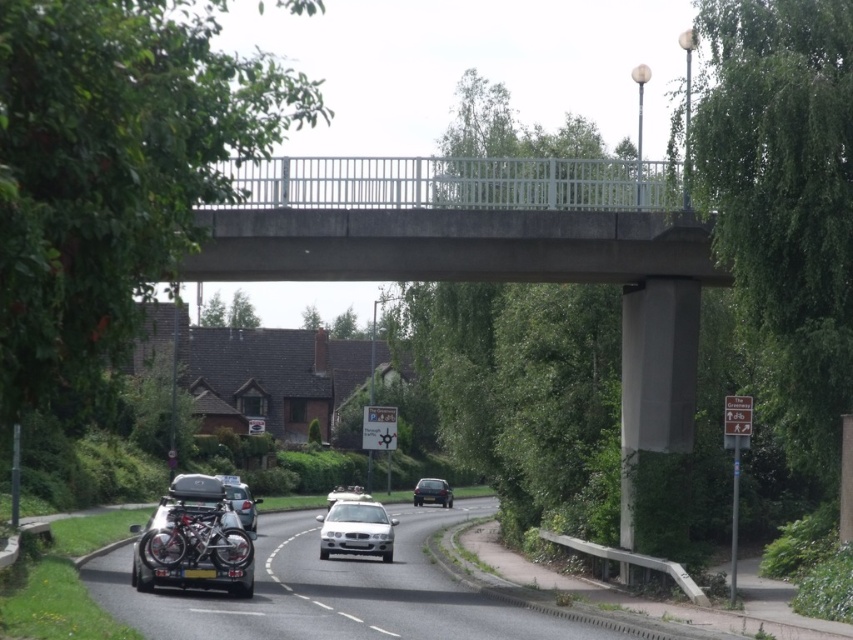
Does metallic silver motorcycle at lower left have a larger size compared to satin silver sedan at center?

Incorrect, metallic silver motorcycle at lower left is not larger than satin silver sedan at center.

Consider the image. Who is more distant from viewer, (189, 500) or (328, 520)?

Positioned behind is point (328, 520).

Find the location of a particular element. metallic silver motorcycle at lower left is located at coordinates (194, 540).

Can you confirm if white glossy car at center is smaller than black plastic license plate at lower center?

No.

This screenshot has width=853, height=640. What do you see at coordinates (347, 493) in the screenshot?
I see `white glossy car at center` at bounding box center [347, 493].

Where is `white glossy car at center`? The image size is (853, 640). white glossy car at center is located at coordinates (347, 493).

Does satin silver sedan at center have a lesser height compared to matte black car at lower left?

Correct, satin silver sedan at center is not as tall as matte black car at lower left.

Consider the image. Is satin silver sedan at center positioned at the back of matte black car at lower left?

No, satin silver sedan at center is in front of matte black car at lower left.

Measure the distance between point [352,518] and camera.

Point [352,518] and camera are 33.18 meters apart from each other.

Locate an element on the screen. The height and width of the screenshot is (640, 853). satin silver sedan at center is located at coordinates (357, 529).